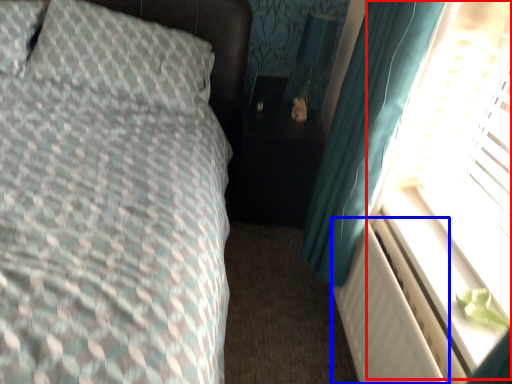
Question: Which of the following is the closest to the observer, window screen (highlighted by a red box) or radiator (highlighted by a blue box)?

Choices:
 (A) window screen
 (B) radiator

Answer: (A)